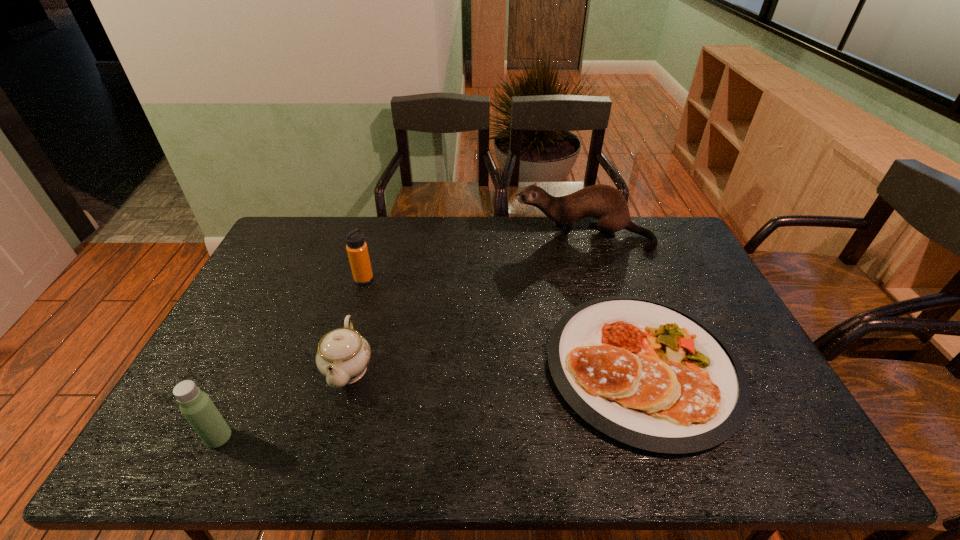
This screenshot has height=540, width=960. Identify the location of the farthest object. (603, 202).

Find the location of a particular element. the farther thermos bottle is located at coordinates (356, 247).

Where is `the right thermos bottle`? This screenshot has width=960, height=540. the right thermos bottle is located at coordinates (356, 247).

Image resolution: width=960 pixels, height=540 pixels. What are the coordinates of `the leftmost object` in the screenshot? It's located at (196, 406).

The image size is (960, 540). Identify the location of the nearer thermos bottle. (196, 406).

This screenshot has height=540, width=960. In order to click on the second shortest object in this screenshot , I will do `click(343, 355)`.

The width and height of the screenshot is (960, 540). In order to click on dish in this screenshot , I will do `click(647, 374)`.

In order to click on vacant point located 0.250m at the face of the farthest object in this screenshot , I will do `click(446, 236)`.

What are the coordinates of `free space located at the face of the farthest object` in the screenshot? It's located at (498, 236).

Where is `free spot located 0.090m at the face of the farthest object`? free spot located 0.090m at the face of the farthest object is located at coordinates (491, 236).